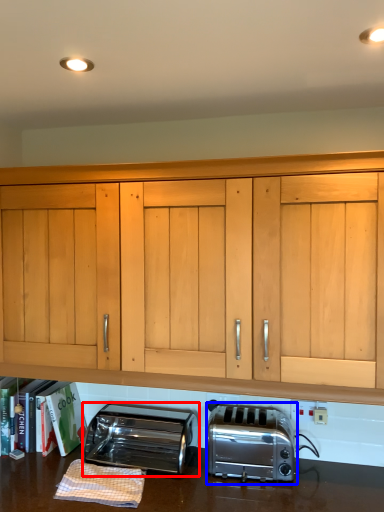
Question: Among these objects, which one is nearest to the camera, toaster (highlighted by a red box) or toaster (highlighted by a blue box)?

Choices:
 (A) toaster
 (B) toaster

Answer: (B)